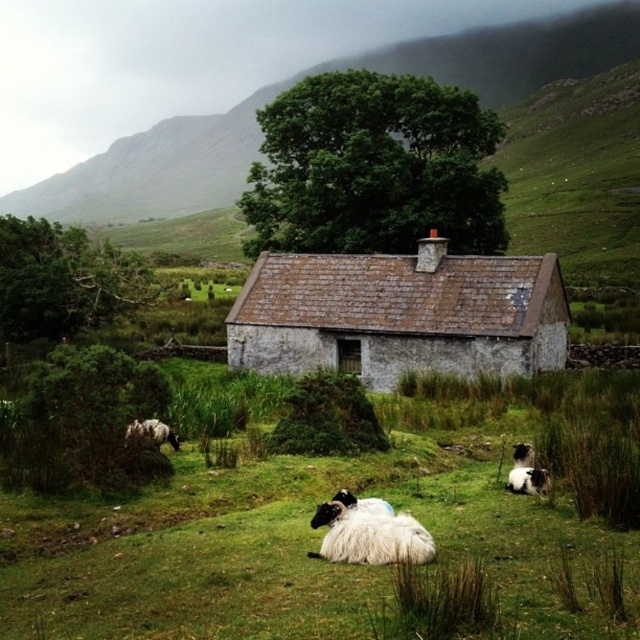
You are a farmer who needs to move the black woolly sheep at lower right into the rustic stone barn at center. Considering their sizes, will the sheep fit inside the barn?

The rustic stone barn at center is bigger than the black woolly sheep at lower right, so the sheep will fit inside the barn.

You are a farmer standing at the cottage door and want to check on your sheep. Which sheep is closer to you, the black woolly sheep at lower right or the white woolly sheep at lower left?

The white woolly sheep at lower left is closer to you because it is only 9.30 meters away from the black woolly sheep at lower right, but since you are at the cottage door, the distance from you to each sheep would depend on their positions relative to the cottage. However, based on the given information, the black woolly sheep at lower right is farther from the white woolly sheep at lower left, so the white one is closer to you.